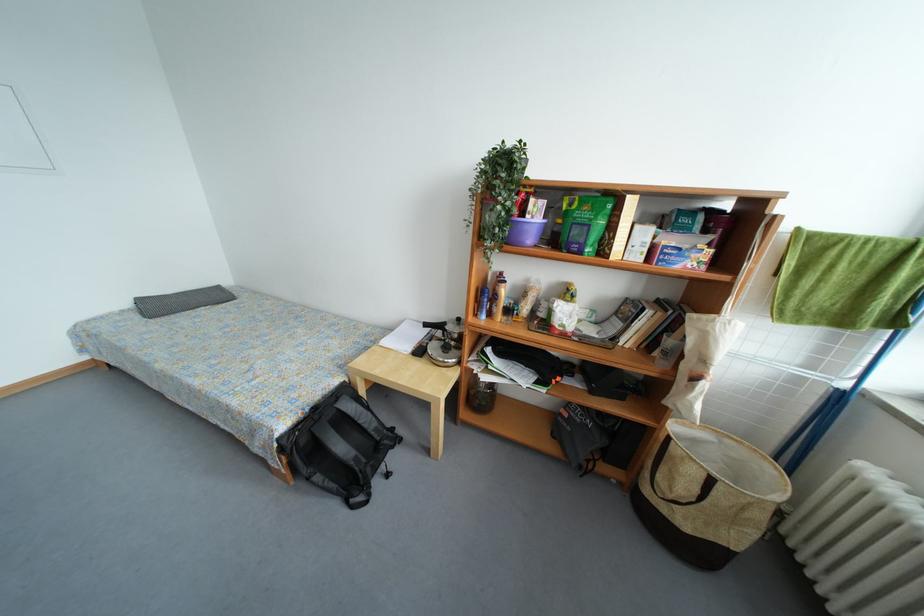
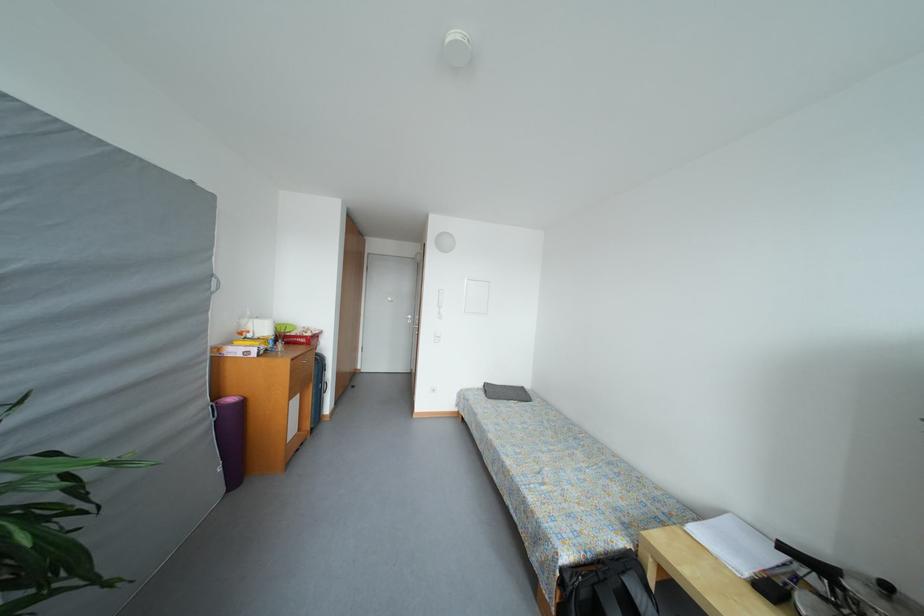
Question: The camera is either moving clockwise (left) or counter-clockwise (right) around the object. The first image is from the beginning of the video and the second image is from the end. Is the camera moving left or right when shooting the video?

Choices:
 (A) Left
 (B) Right

Answer: (B)